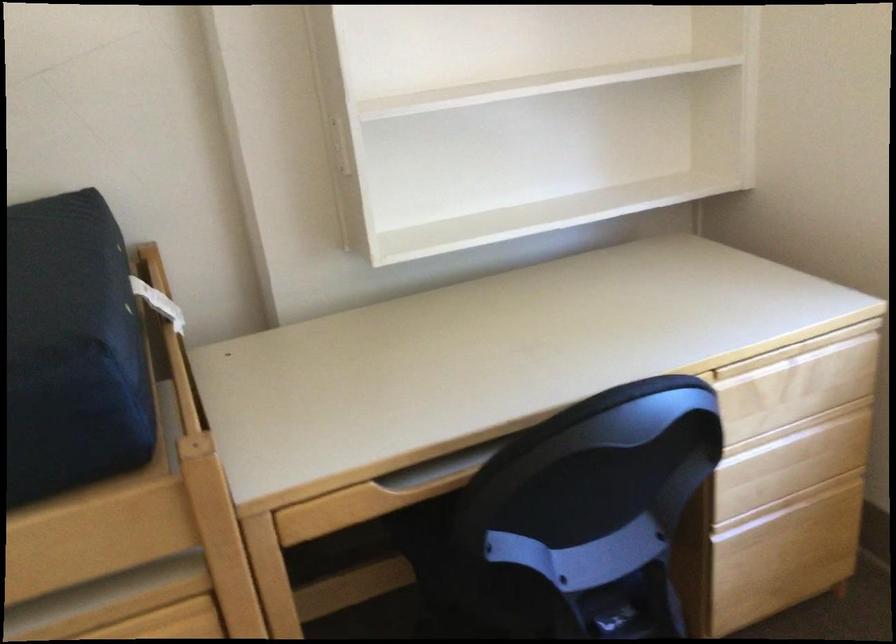
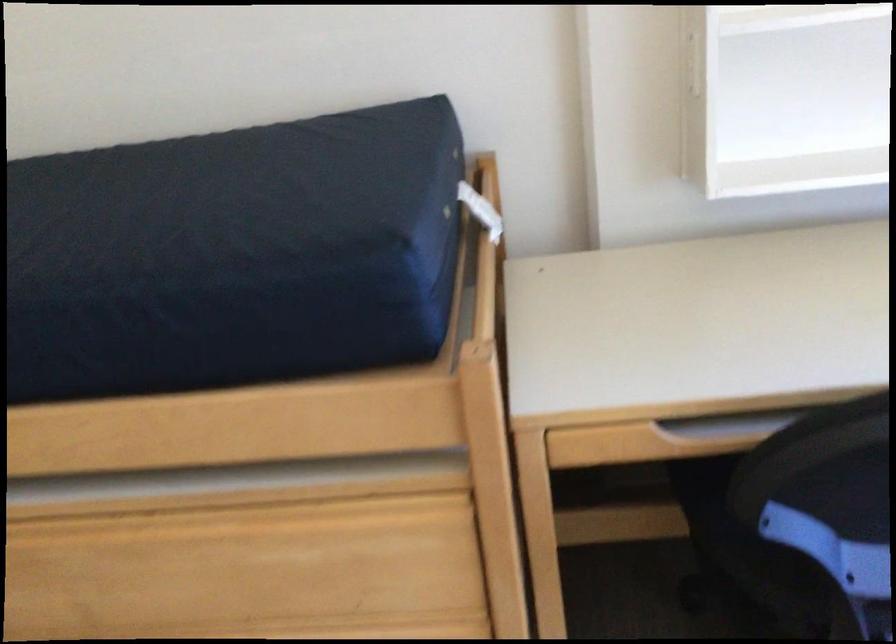
Find the pixel in the second image that matches (162,307) in the first image.

(480, 211)